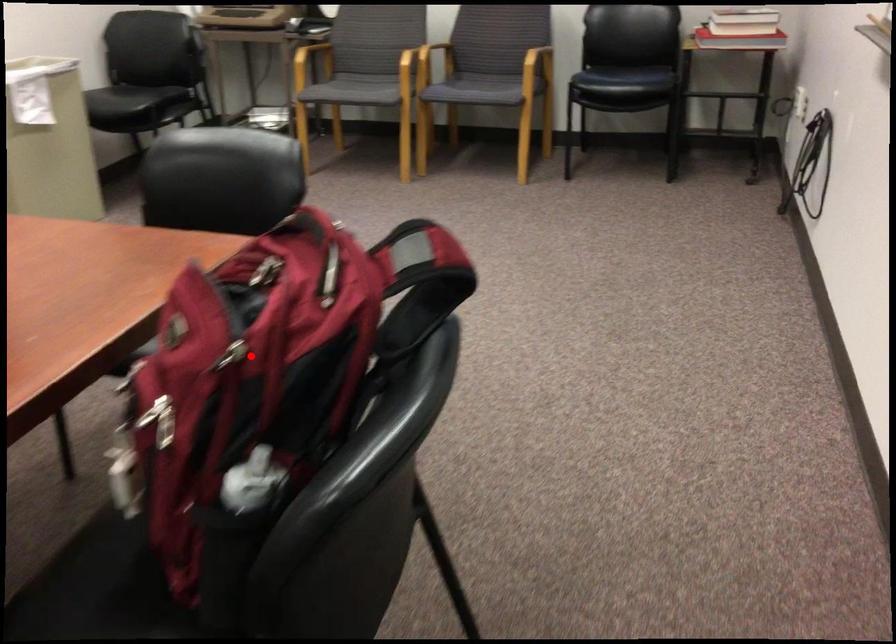
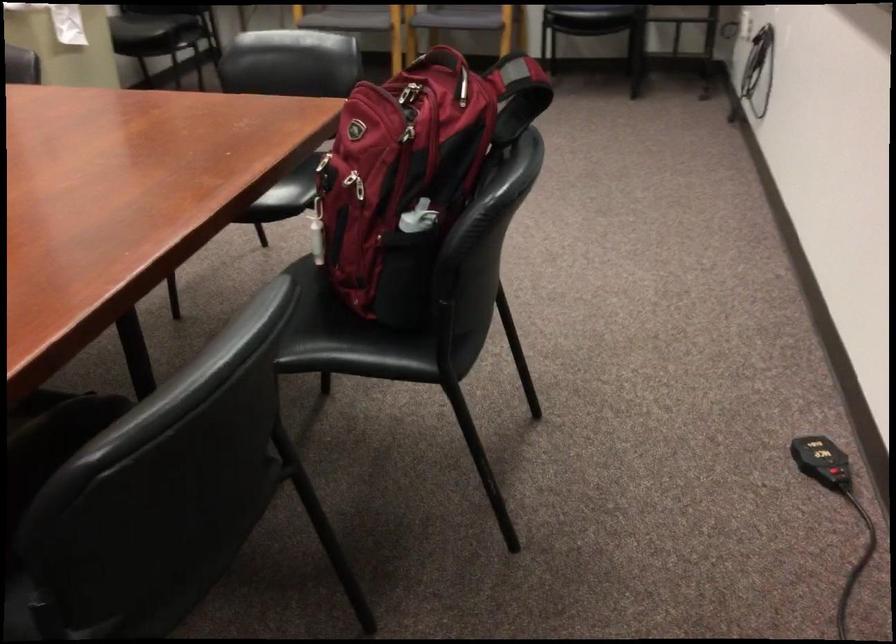
Question: I am providing you with two images of the same scene from different viewpoints. A red point is shown in image1. For the corresponding object point in image2, is it positioned nearer or farther from the camera?

Choices:
 (A) Nearer
 (B) Farther

Answer: (B)